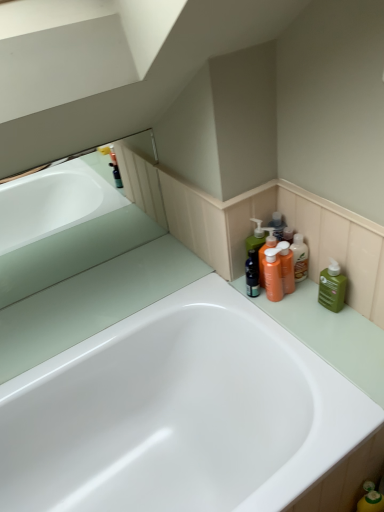
Identify the location of vacant point to the right of orange matte pump bottle at upper right, the second cleaning product positioned from the right. (321, 303).